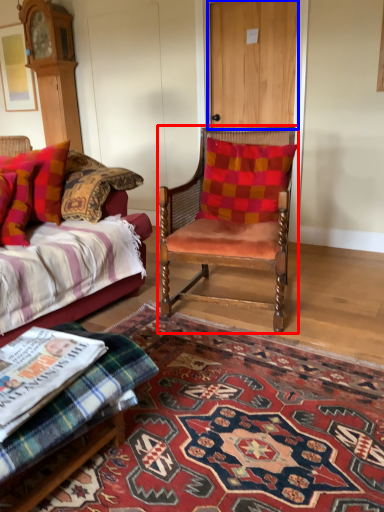
Question: Which object is closer to the camera taking this photo, chair (highlighted by a red box) or door (highlighted by a blue box)?

Choices:
 (A) chair
 (B) door

Answer: (A)